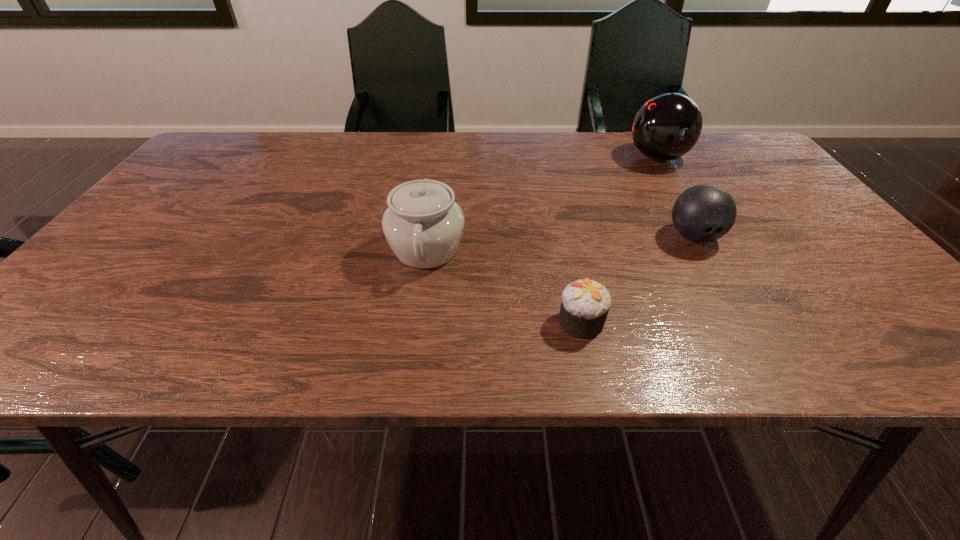
This screenshot has height=540, width=960. In the image, there is a desktop. In order to click on free space at the far left corner in this screenshot , I will do `click(235, 143)`.

Where is `vacant space that is in between the taller bowling ball and the shortest object`? Image resolution: width=960 pixels, height=540 pixels. vacant space that is in between the taller bowling ball and the shortest object is located at coordinates tap(619, 240).

Find the location of `vacant region between the second tallest object and the cupcake`. vacant region between the second tallest object and the cupcake is located at coordinates (504, 286).

You are a GUI agent. You are given a task and a screenshot of the screen. Output one action in this format:
    pyautogui.click(x=<x>, y=<y>)
    Task: Click on the free space between the shortest object and the second tallest object
    The image size is (960, 540).
    Given the screenshot: What is the action you would take?
    pos(504,286)

At what (x,y) coordinates should I click in order to perform the action: click on free spot between the nearer bowling ball and the second tallest object. Please return your answer as a coordinate pair (x, y). This screenshot has height=540, width=960. Looking at the image, I should click on (560, 243).

Locate an element on the screen. The image size is (960, 540). free point between the shorter bowling ball and the cupcake is located at coordinates (637, 279).

The width and height of the screenshot is (960, 540). What are the coordinates of `vacant space that is in between the shortest object and the shorter bowling ball` in the screenshot? It's located at (637, 279).

The height and width of the screenshot is (540, 960). Find the location of `free space between the second tallest object and the farthest object`. free space between the second tallest object and the farthest object is located at coordinates (542, 204).

Locate an element on the screen. The image size is (960, 540). empty location between the chinaware and the shortest object is located at coordinates (504, 286).

What are the coordinates of `free spot between the taller bowling ball and the chinaware` in the screenshot? It's located at (542, 204).